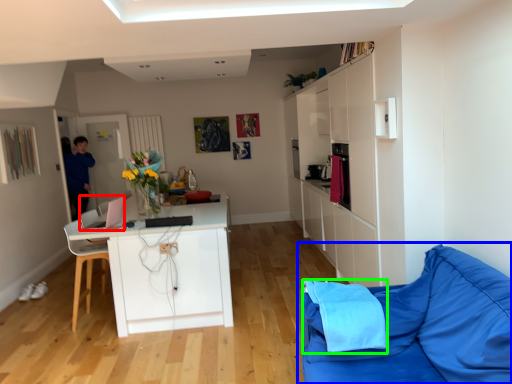
Question: Estimate the real-world distances between objects in this image. Which object is closer to appliance (highlighted by a red box), studio couch (highlighted by a blue box) or material (highlighted by a green box)?

Choices:
 (A) studio couch
 (B) material

Answer: (B)